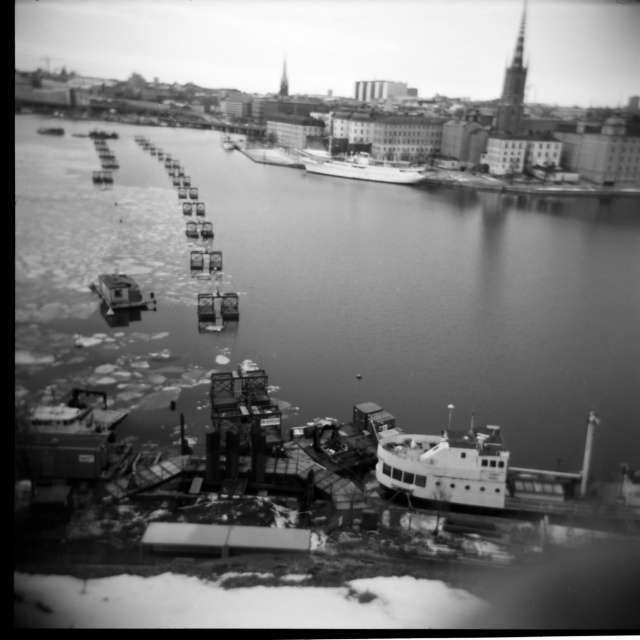
Question: Is white matte boat at center to the left of metallic gray boat at lower left from the viewer's perspective?

Choices:
 (A) yes
 (B) no

Answer: (B)

Question: Which is farther from the smooth white ship at center?

Choices:
 (A) metallic gray boat at lower left
 (B) smooth wood dock at center
 (C) white matte boat at lower right
 (D) smooth water at center

Answer: (B)

Question: Can you confirm if smooth water at center is positioned above smooth wood dock at center?

Choices:
 (A) yes
 (B) no

Answer: (A)

Question: Estimate the real-world distances between objects in this image. Which object is closer to the metallic gray boat at lower left?

Choices:
 (A) white matte boat at lower right
 (B) smooth wood dock at center
 (C) smooth white ship at center
 (D) smooth water at center

Answer: (A)

Question: Considering the relative positions of white matte boat at lower right and white matte boat at center in the image provided, where is white matte boat at lower right located with respect to white matte boat at center?

Choices:
 (A) above
 (B) below

Answer: (B)

Question: Which point is closer to the camera?

Choices:
 (A) (497, 445)
 (B) (232, 525)
 (C) (630, 442)

Answer: (B)